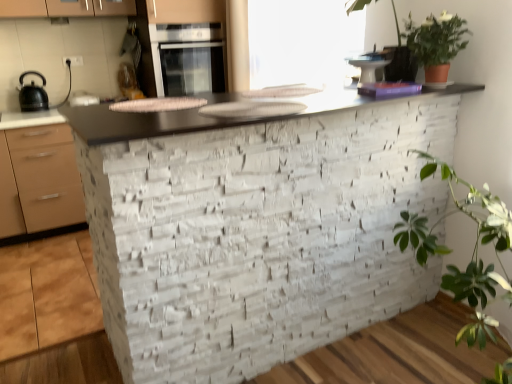
The height and width of the screenshot is (384, 512). What are the coordinates of `free space below green matte plant at upper right (from a real-world perspective)` in the screenshot? It's located at (425, 82).